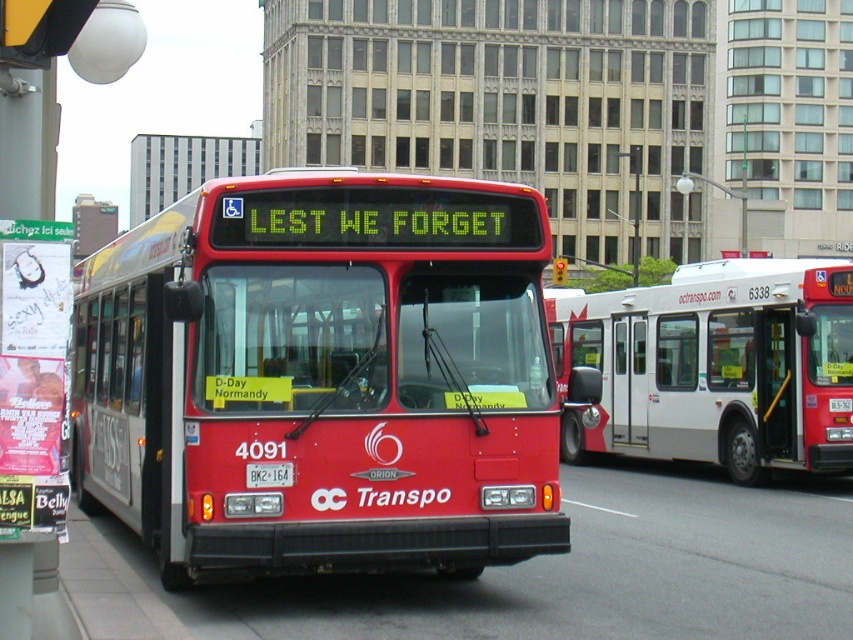
Which is in front, point (228, 508) or point (764, 435)?

Positioned in front is point (228, 508).

This screenshot has height=640, width=853. Find the location of `matte red bus at center`. matte red bus at center is located at coordinates pyautogui.click(x=322, y=376).

Who is lower down, white matte bus at center or white plastic license plate at center?

Positioned lower is white plastic license plate at center.

Is white matte bus at center below white plastic license plate at center?

No.

The width and height of the screenshot is (853, 640). Describe the element at coordinates (717, 365) in the screenshot. I see `white matte bus at center` at that location.

At what (x,y) coordinates should I click in order to perform the action: click on white matte bus at center. Please return your answer as a coordinate pair (x, y). Looking at the image, I should click on (717, 365).

Who is positioned more to the right, matte red bus at center or white plastic license plate at center?

white plastic license plate at center

Measure the distance from matte red bus at center to white plastic license plate at center.

1.51 meters

Who is more forward, (x=496, y=502) or (x=258, y=481)?

Point (x=258, y=481) is more forward.

Locate an element on the screen. This screenshot has width=853, height=640. matte red bus at center is located at coordinates (322, 376).